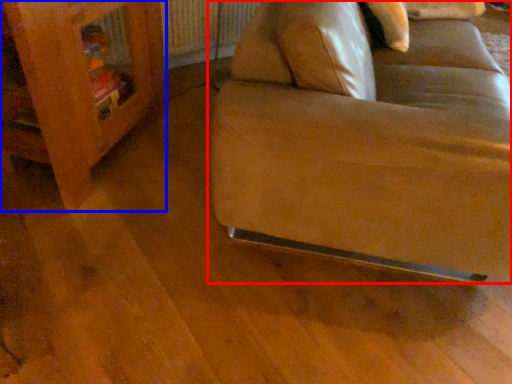
Question: Which object appears closest to the camera in this image, studio couch (highlighted by a red box) or furniture (highlighted by a blue box)?

Choices:
 (A) studio couch
 (B) furniture

Answer: (A)